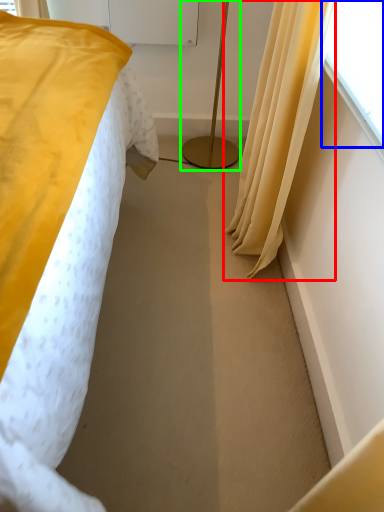
Question: Which object is the farthest from curtain (highlighted by a red box)? Choose among these: window screen (highlighted by a blue box) or bedside lamp (highlighted by a green box).

Choices:
 (A) window screen
 (B) bedside lamp

Answer: (B)